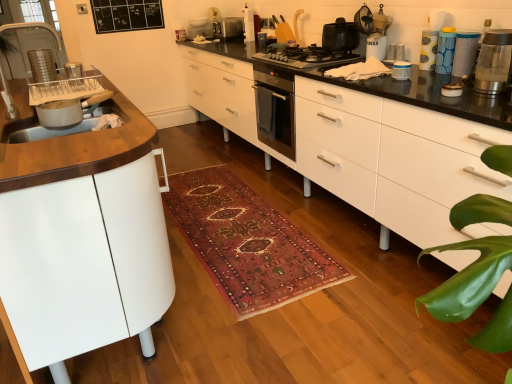
This screenshot has height=384, width=512. I want to click on free point to the right of white matte cabinet at left, so click(263, 265).